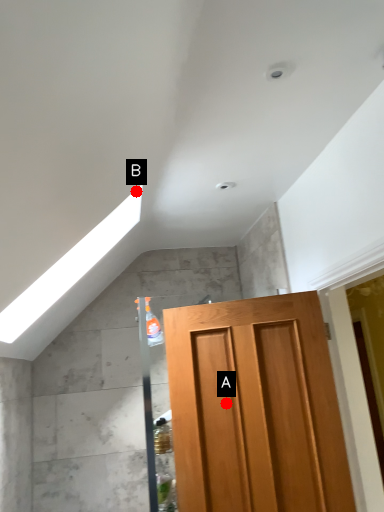
Question: Two points are circled on the image, labeled by A and B beside each circle. Among these points, which one is nearest to the camera?

Choices:
 (A) A is closer
 (B) B is closer

Answer: (B)